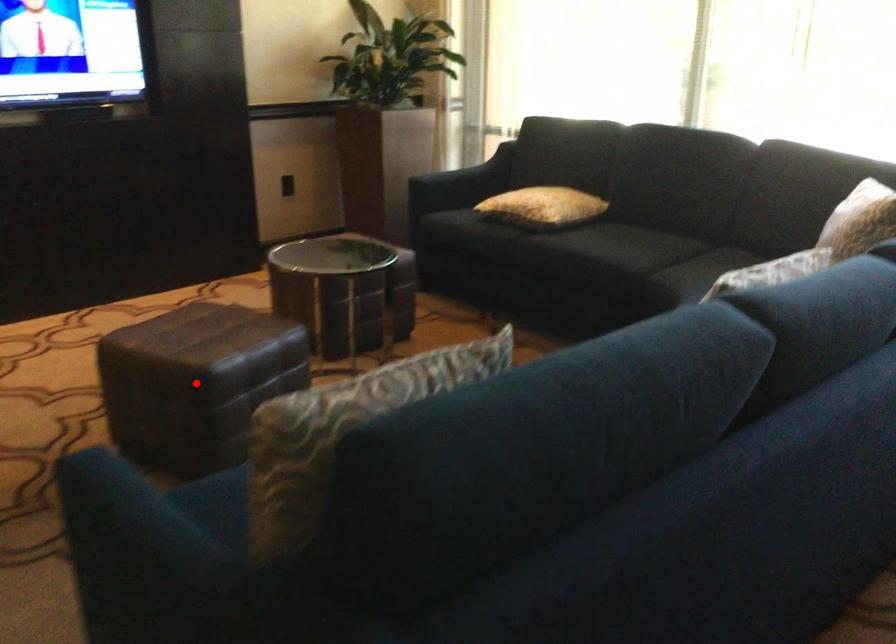
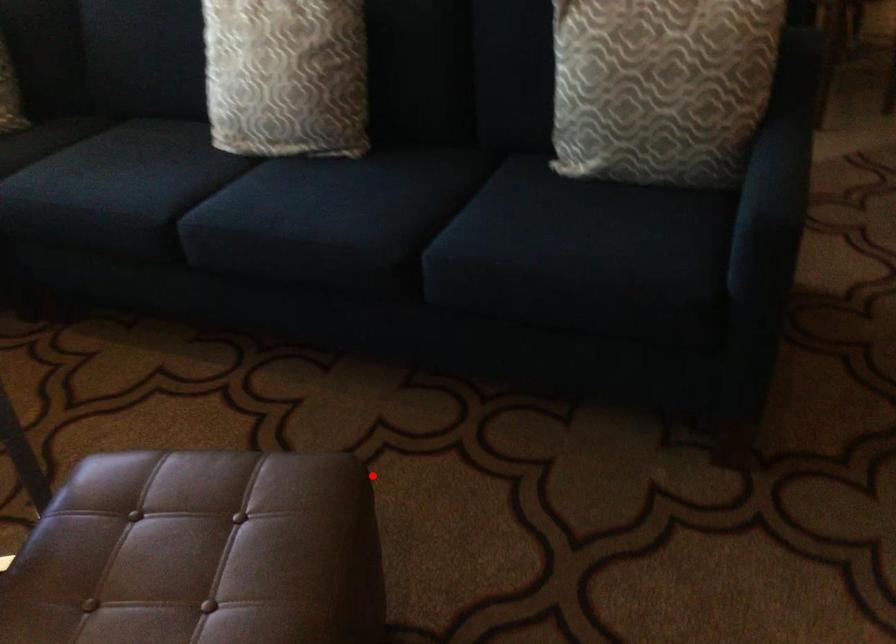
I am providing you with two images of the same scene from different viewpoints. A red point is marked on the first image and another point is marked on the second image. Does the point marked in image1 correspond to the same location as the one in image2?

Yes